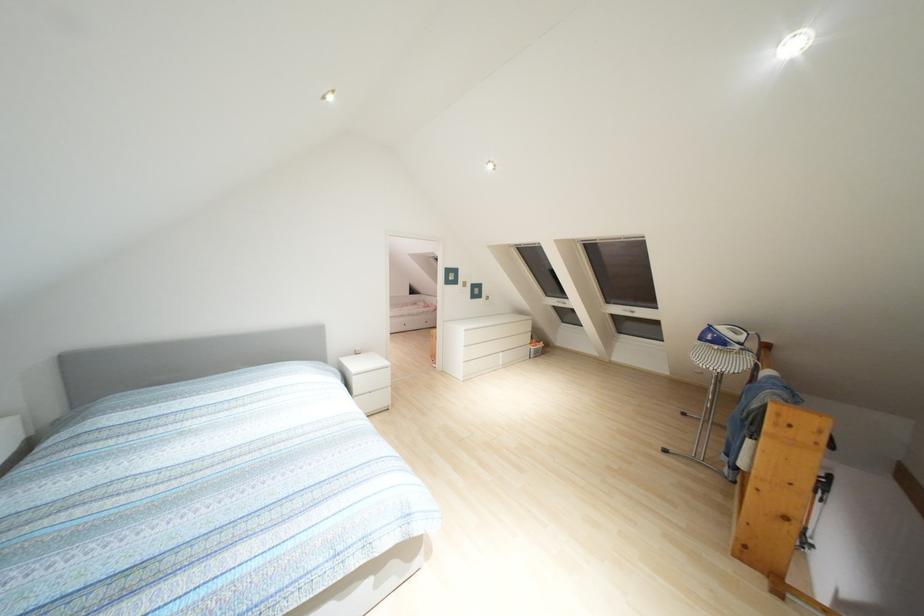
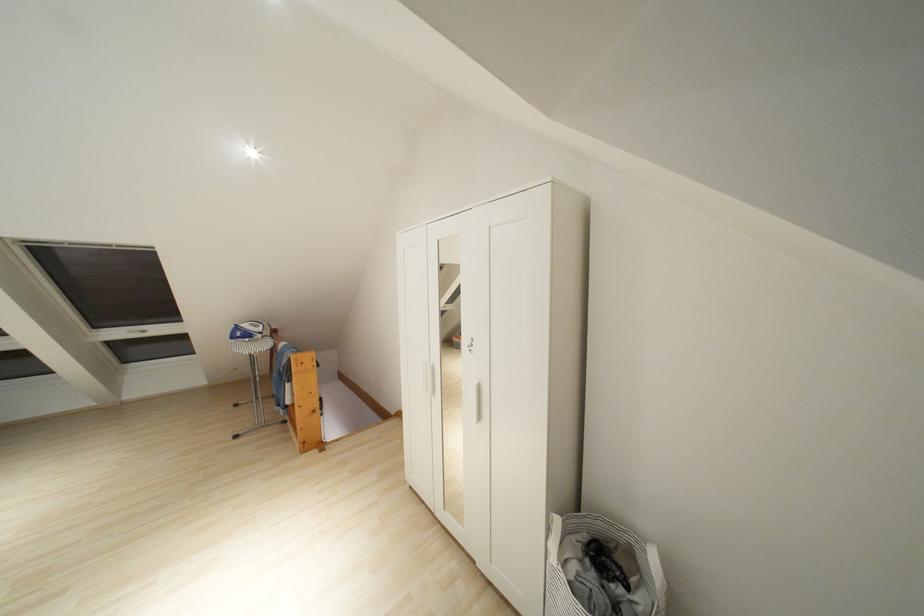
In the second image, find the point that corresponds to (631,312) in the first image.

(141, 331)